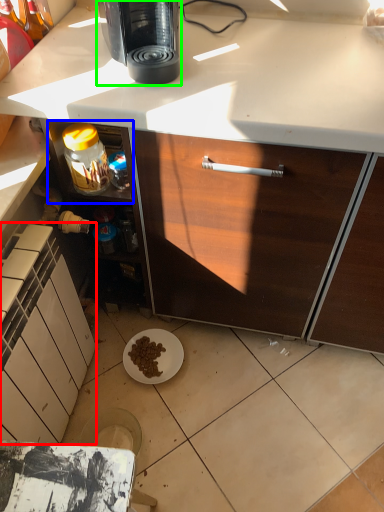
Question: Considering the real-world distances, which object is farthest from cabinetry (highlighted by a red box)? shelf (highlighted by a blue box) or coffee maker (highlighted by a green box)?

Choices:
 (A) shelf
 (B) coffee maker

Answer: (B)